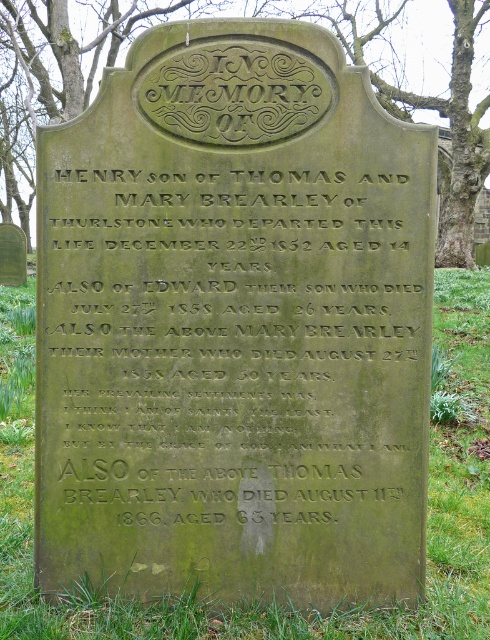
Measure the distance from green stone inscription at center to green mossy stone at lower center.

green stone inscription at center is 1.16 meters away from green mossy stone at lower center.

What do you see at coordinates (234, 342) in the screenshot?
I see `green stone inscription at center` at bounding box center [234, 342].

You are a GUI agent. You are given a task and a screenshot of the screen. Output one action in this format:
    pyautogui.click(x=<x>, y=<y>)
    Task: Click on the green stone inscription at center
    This screenshot has width=490, height=640.
    Given the screenshot: What is the action you would take?
    pyautogui.click(x=234, y=342)

Can you confirm if green mossy stone at lower center is wider than green mossy stone at upper center?

In fact, green mossy stone at lower center might be narrower than green mossy stone at upper center.

Does green mossy stone at lower center appear over green mossy stone at upper center?

No, green mossy stone at lower center is not above green mossy stone at upper center.

Find the location of a particular element. Image resolution: width=490 pixels, height=640 pixels. green mossy stone at lower center is located at coordinates (273, 602).

Is point (289, 438) closer to viewer compared to point (388, 104)?

Yes, point (289, 438) is in front of point (388, 104).

Which is behind, point (348, 404) or point (458, 124)?

Point (458, 124)

Where is `green stone inscription at center`? The image size is (490, 640). green stone inscription at center is located at coordinates (234, 342).